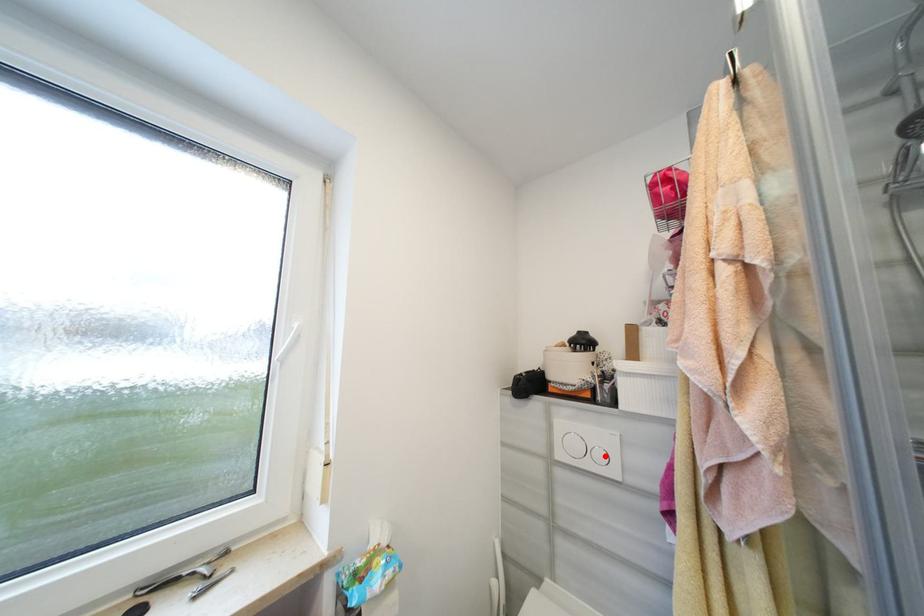
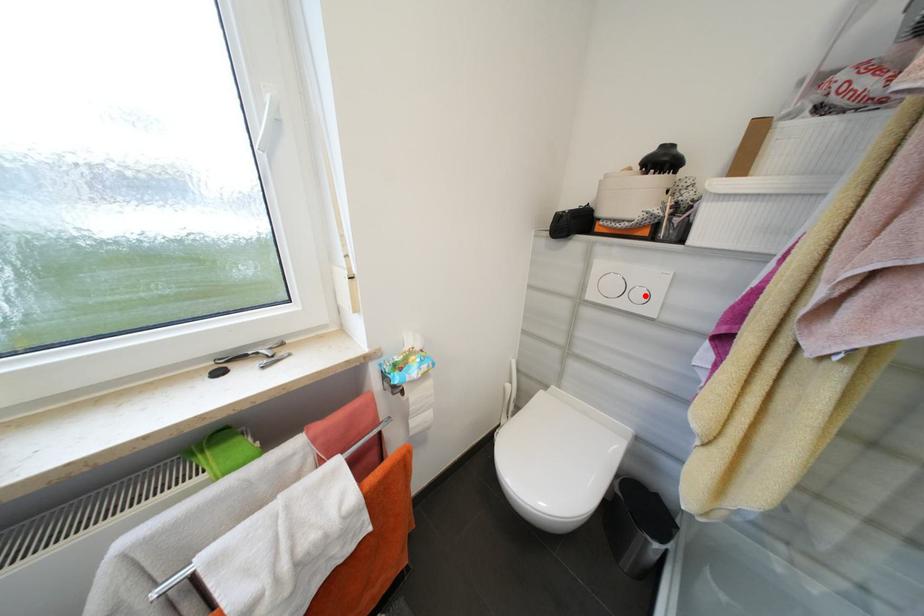
I am providing you with two images of the same scene from different viewpoints. A red point is marked on the first image and another point is marked on the second image. Do the highlighted points in image1 and image2 indicate the same real-world spot?

Yes